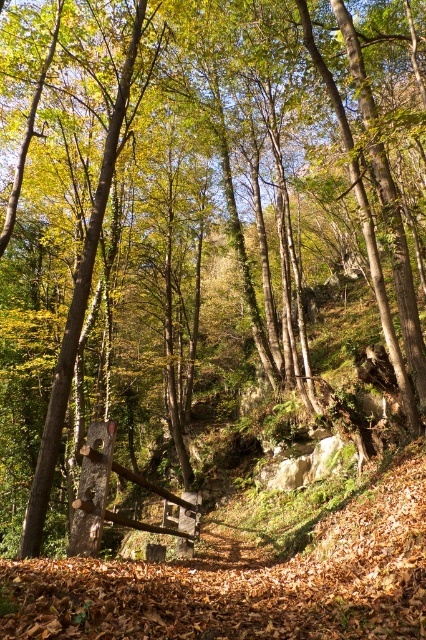
Question: Can you confirm if brown wood tree at center is smaller than wooden log at center?

Choices:
 (A) yes
 (B) no

Answer: (B)

Question: Is the position of brown wood tree at center less distant than that of wooden log at center?

Choices:
 (A) no
 (B) yes

Answer: (A)

Question: Can you confirm if brown wood tree at center is positioned to the right of wooden log at center?

Choices:
 (A) no
 (B) yes

Answer: (A)

Question: Which point is closer to the camera?

Choices:
 (A) wooden log at center
 (B) brown wood tree at center

Answer: (A)